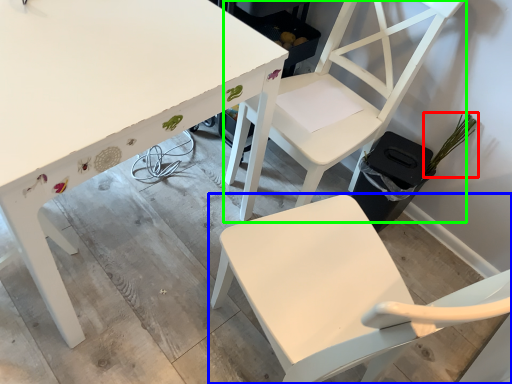
Question: Which is nearer to the plant (highlighted by a red box)? chair (highlighted by a blue box) or chair (highlighted by a green box).

Choices:
 (A) chair
 (B) chair

Answer: (B)